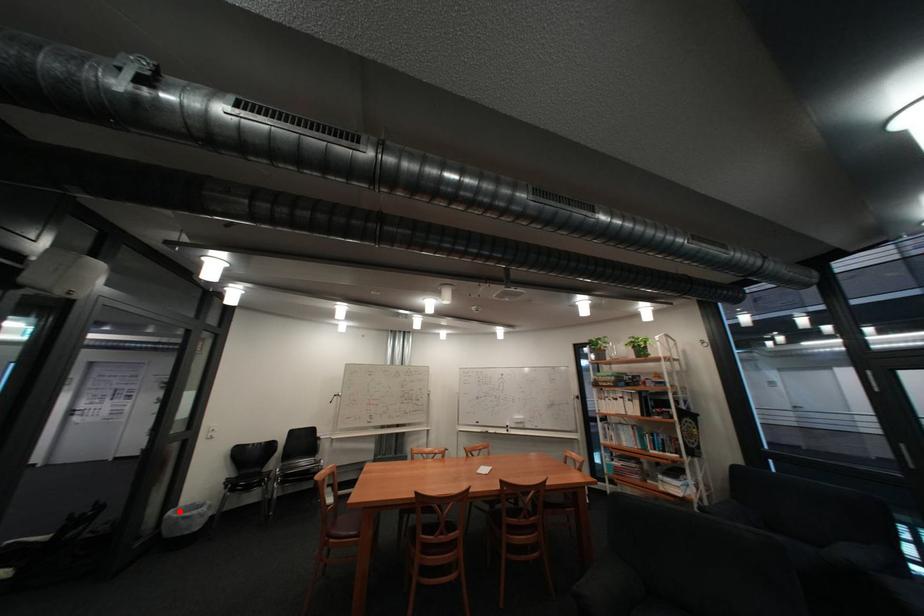
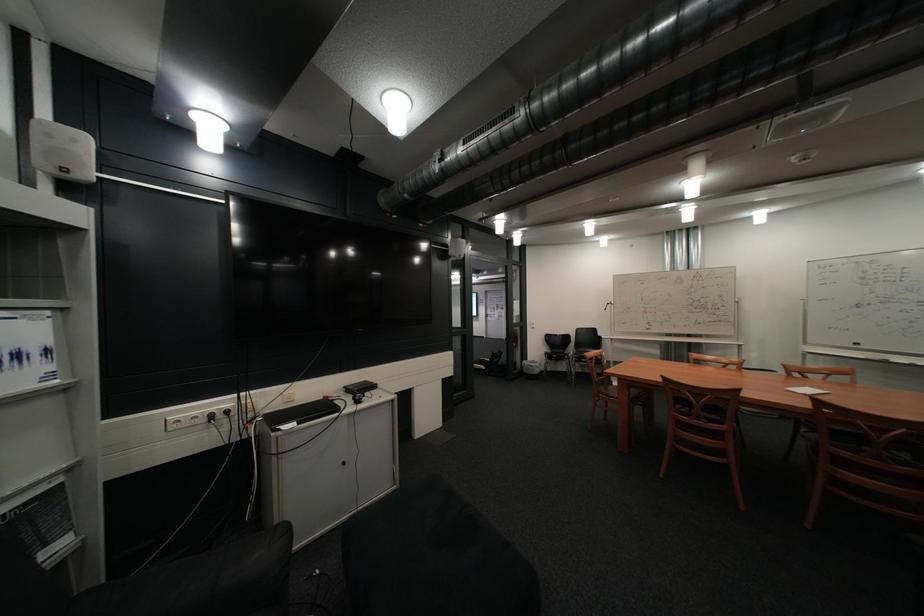
Question: I am providing you with two images of the same scene from different viewpoints. A red point is marked on the first image. Is the red point's position out of view in image 2?

Choices:
 (A) Yes
 (B) No

Answer: (B)